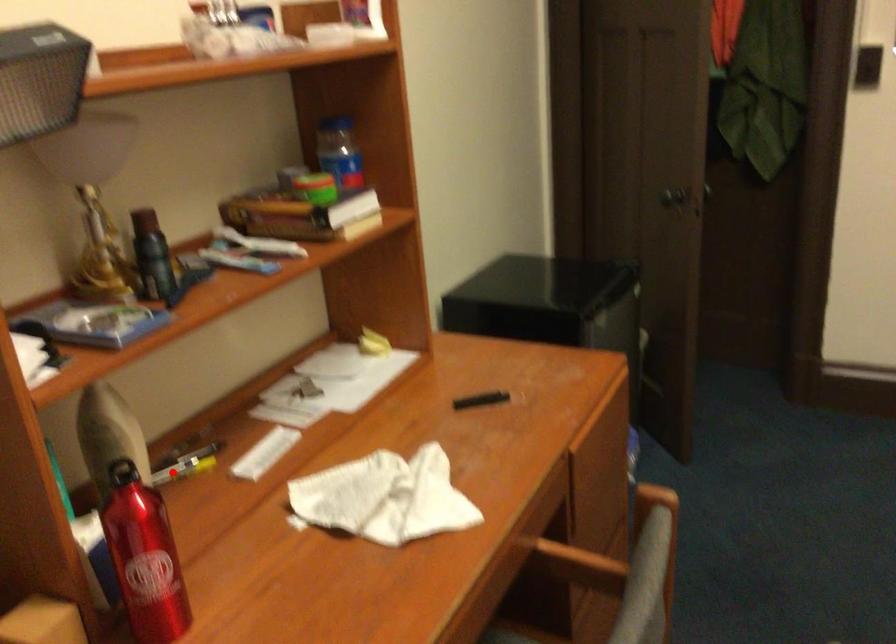
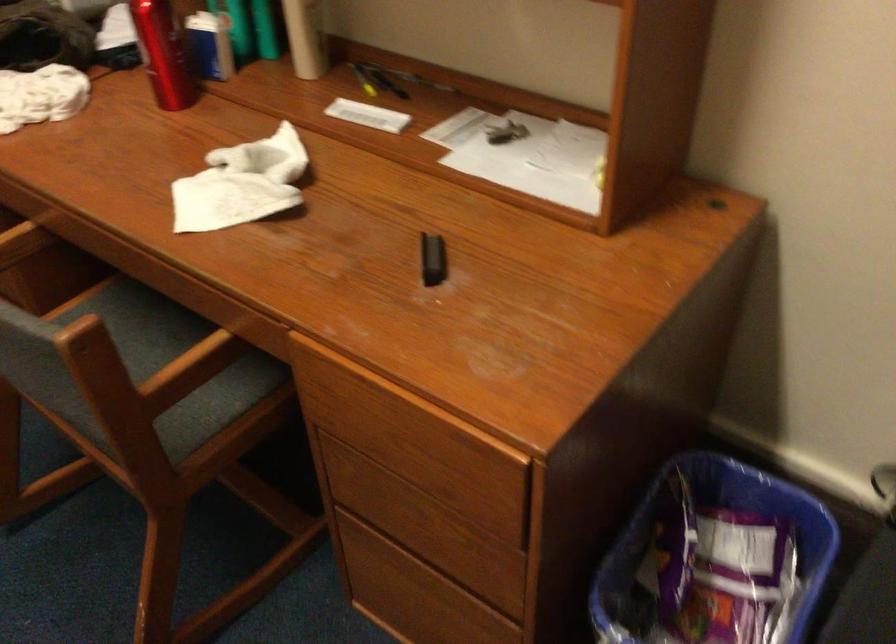
Question: A red point is marked in image1. In image2, is the corresponding 3D point closer to the camera or farther? Reply with the corresponding letter.

Choices:
 (A) The corresponding 3D point is closer.
 (B) The corresponding 3D point is farther.

Answer: (B)